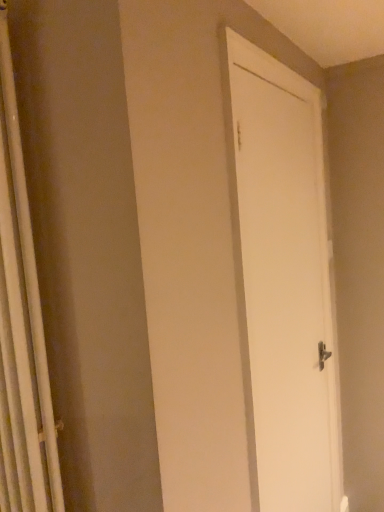
Question: Is white matte door at center bigger or smaller than white fabric shower curtain at left?

Choices:
 (A) small
 (B) big

Answer: (B)

Question: In terms of height, does white matte door at center look taller or shorter compared to white fabric shower curtain at left?

Choices:
 (A) short
 (B) tall

Answer: (B)

Question: From the image's perspective, is white matte door at center positioned above or below white fabric shower curtain at left?

Choices:
 (A) above
 (B) below

Answer: (B)

Question: Considering their positions, is white fabric shower curtain at left located in front of or behind white matte door at center?

Choices:
 (A) behind
 (B) front

Answer: (B)

Question: From the image's perspective, is white fabric shower curtain at left positioned above or below white matte door at center?

Choices:
 (A) below
 (B) above

Answer: (B)

Question: Considering the relative positions of white fabric shower curtain at left and white matte door at center in the image provided, is white fabric shower curtain at left to the left or to the right of white matte door at center?

Choices:
 (A) left
 (B) right

Answer: (A)

Question: Looking at the image, does white fabric shower curtain at left seem bigger or smaller compared to white matte door at center?

Choices:
 (A) big
 (B) small

Answer: (B)